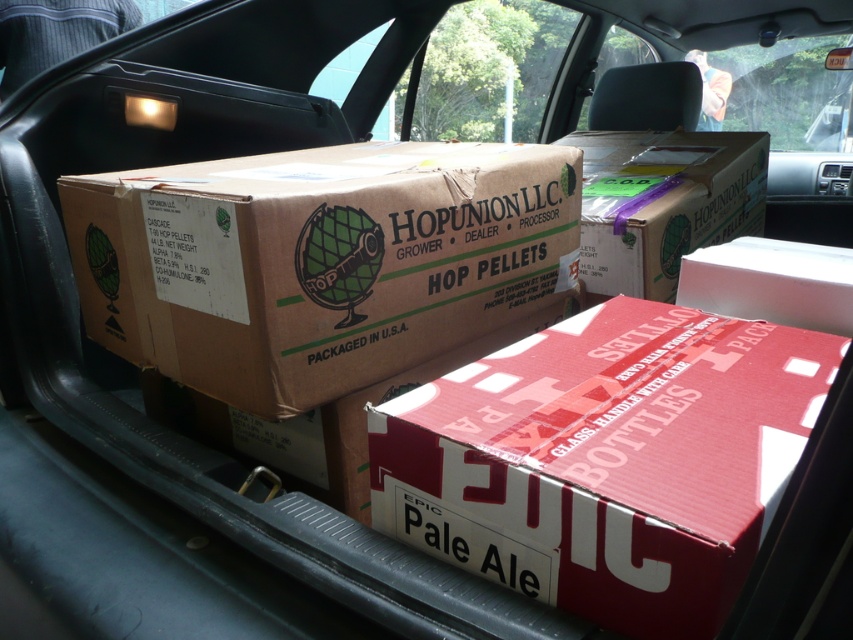
Measure the distance from red cardboard box at center to brown cardboard box at center.

13.56 inches

Which is more to the right, red cardboard box at center or brown cardboard box at center?

red cardboard box at center is more to the right.

Which is in front, point (498, 531) or point (148, 234)?

Point (498, 531)

This screenshot has width=853, height=640. Find the location of `red cardboard box at center`. red cardboard box at center is located at coordinates (607, 460).

Between point (381, 273) and point (647, 180), which one is positioned behind?

The point (647, 180) is behind.

Does brown cardboard box at center appear under brown cardboard box at upper center?

Correct, brown cardboard box at center is located below brown cardboard box at upper center.

You are a GUI agent. You are given a task and a screenshot of the screen. Output one action in this format:
    pyautogui.click(x=<x>, y=<y>)
    Task: Click on the brown cardboard box at center
    
    Given the screenshot: What is the action you would take?
    pyautogui.click(x=318, y=260)

Can you confirm if red cardboard box at center is shorter than brown cardboard box at upper center?

Yes.

Does red cardboard box at center have a greater width compared to brown cardboard box at upper center?

No.

The height and width of the screenshot is (640, 853). What do you see at coordinates (607, 460) in the screenshot? I see `red cardboard box at center` at bounding box center [607, 460].

Find the location of a particular element. red cardboard box at center is located at coordinates (607, 460).